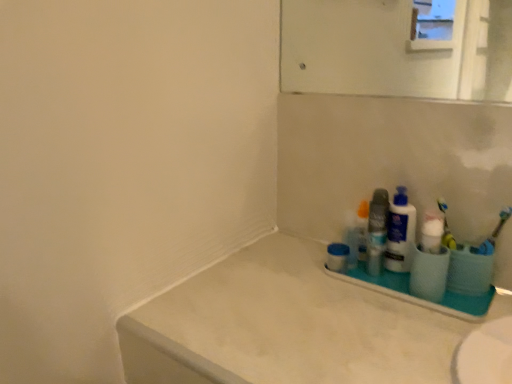
The width and height of the screenshot is (512, 384). In order to click on vacant region to the left of blue matte jar at right in this screenshot , I will do `click(273, 271)`.